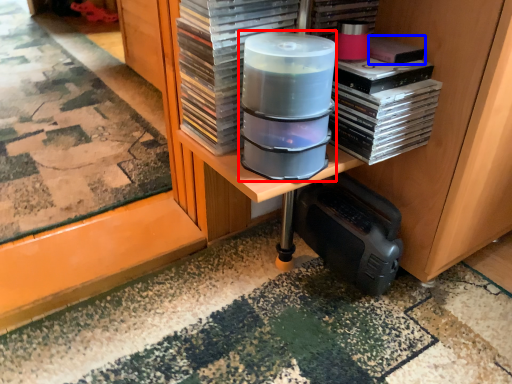
Question: Which object appears closest to the camera in this image, appliance (highlighted by a red box) or paperback book (highlighted by a blue box)?

Choices:
 (A) appliance
 (B) paperback book

Answer: (A)